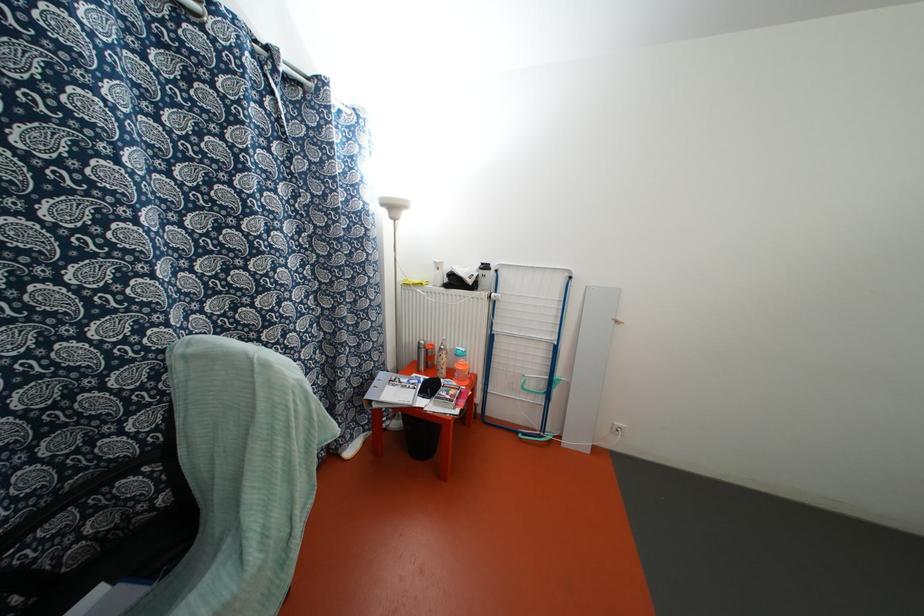
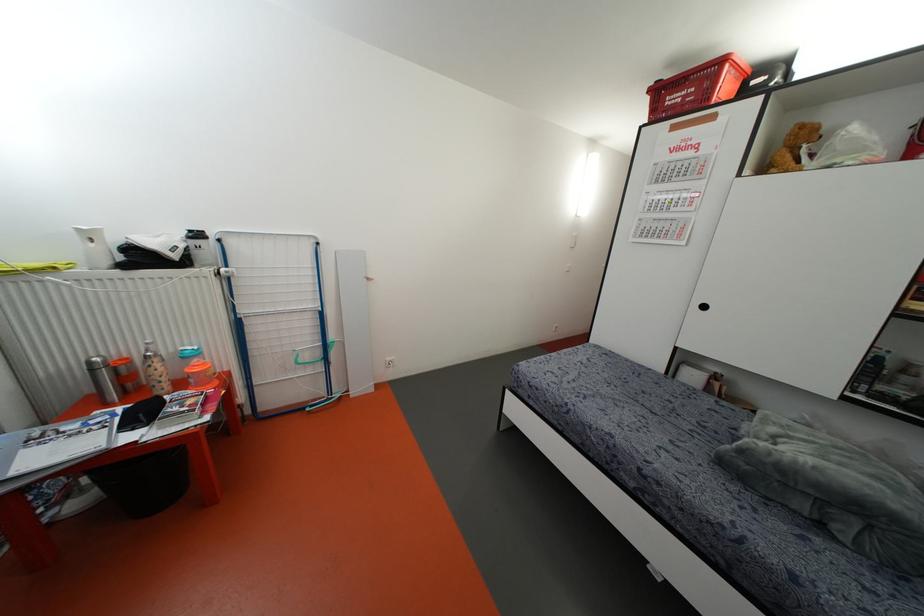
Where in the second image is the point corresponding to [440,283] from the first image?

(107, 262)